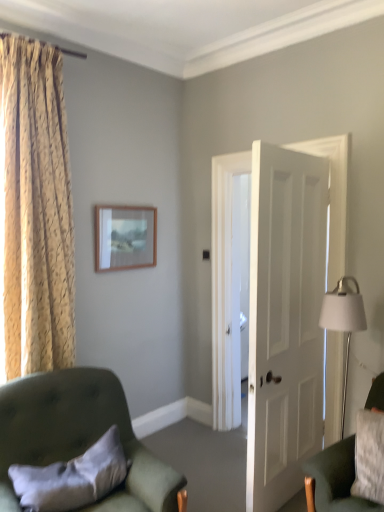
Question: In terms of width, does white matte door at center look wider or thinner when compared to velvet green armchair at lower right, the second chair when ordered from left to right?

Choices:
 (A) wide
 (B) thin

Answer: (B)

Question: In terms of height, does white matte door at center look taller or shorter compared to velvet green armchair at lower right, the second chair when ordered from left to right?

Choices:
 (A) short
 (B) tall

Answer: (B)

Question: Estimate the real-world distances between objects in this image. Which object is closer to the wooden picture frame at upper center?

Choices:
 (A) gold textured curtain at left
 (B) velvet green armchair at lower left, arranged as the 2th chair when viewed from the right
 (C) white matte door at center
 (D) white soft pillow at lower left
 (E) velvet green armchair at lower right, arranged as the first chair when viewed from the right

Answer: (A)

Question: Which object is the closest to the velvet green armchair at lower left, positioned as the 1th chair in left-to-right order?

Choices:
 (A) white matte door at center
 (B) white soft pillow at lower left
 (C) gold textured curtain at left
 (D) velvet green armchair at lower right, the second chair when ordered from left to right
 (E) wooden picture frame at upper center

Answer: (B)